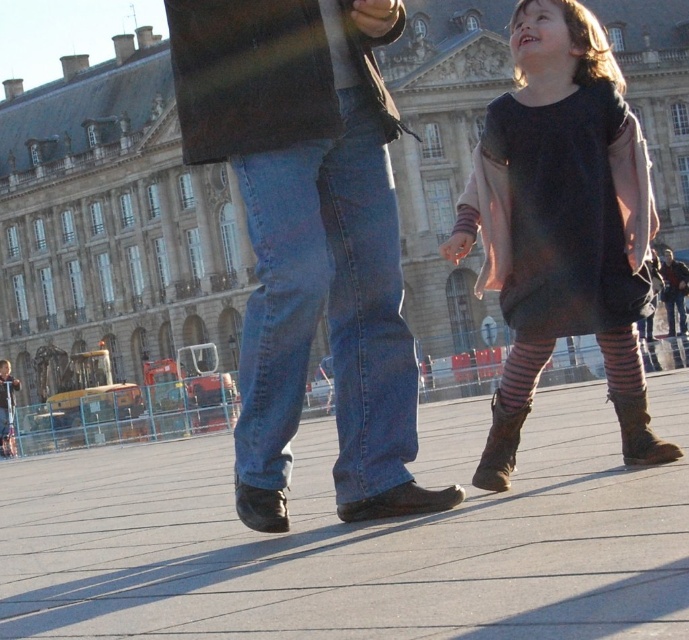
Question: Is smooth concrete pavement at center to the left of striped tights at lower right from the viewer's perspective?

Choices:
 (A) no
 (B) yes

Answer: (B)

Question: Which object is the farthest from the striped tights at lower right?

Choices:
 (A) striped fabric sock at lower right
 (B) brown suede boot at lower right
 (C) smooth concrete pavement at center

Answer: (C)

Question: Which of the following is the farthest from the observer?

Choices:
 (A) (477, 486)
 (B) (307, 161)

Answer: (A)

Question: Does striped tights at lower right appear on the left side of brown leather boot at lower right?

Choices:
 (A) no
 (B) yes

Answer: (B)

Question: Where is smooth concrete pavement at center located in relation to stone building at center in the image?

Choices:
 (A) below
 (B) above

Answer: (A)

Question: Which object appears closest to the camera in this image?

Choices:
 (A) striped tights at lower right
 (B) striped fabric sock at lower center
 (C) matte blue jeans at center
 (D) brown leather boot at lower right

Answer: (D)